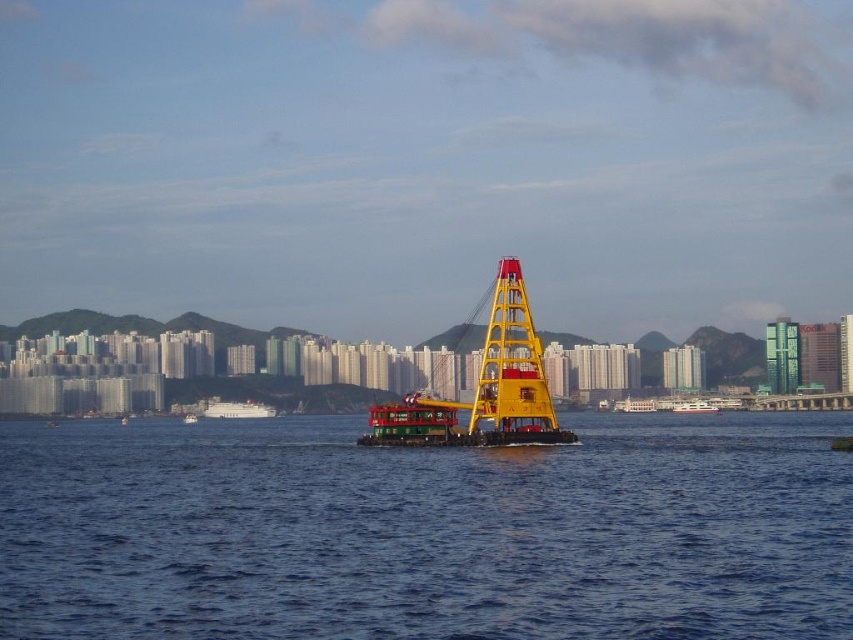
Does blue water at center lie behind yellow metallic crane at center?

No.

Can you confirm if blue water at center is shorter than yellow metallic crane at center?

Correct, blue water at center is not as tall as yellow metallic crane at center.

Which is in front, point (645, 500) or point (486, 385)?

Positioned in front is point (645, 500).

What are the coordinates of `blue water at center` in the screenshot? It's located at (x=426, y=531).

Can you confirm if white matte boat at center is bigger than white glossy ferry at center?

Yes, white matte boat at center is bigger than white glossy ferry at center.

Does point (210, 397) come farther from viewer compared to point (701, 412)?

Yes, it is behind point (701, 412).

Identify the location of white matte boat at center. The width and height of the screenshot is (853, 640). (236, 410).

Does yellow metallic crane at center appear under white matte boat at center?

No, yellow metallic crane at center is not below white matte boat at center.

Image resolution: width=853 pixels, height=640 pixels. What do you see at coordinates (483, 387) in the screenshot?
I see `yellow metallic crane at center` at bounding box center [483, 387].

The height and width of the screenshot is (640, 853). Identify the location of yellow metallic crane at center. (483, 387).

At what (x,y) coordinates should I click in order to perform the action: click on yellow metallic crane at center. Please return your answer as a coordinate pair (x, y). This screenshot has width=853, height=640. Looking at the image, I should click on (483, 387).